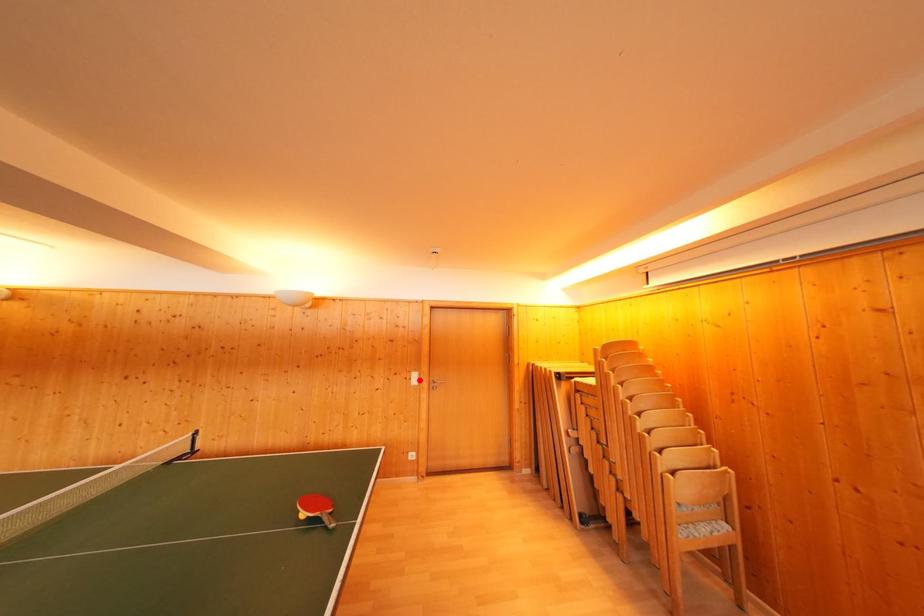
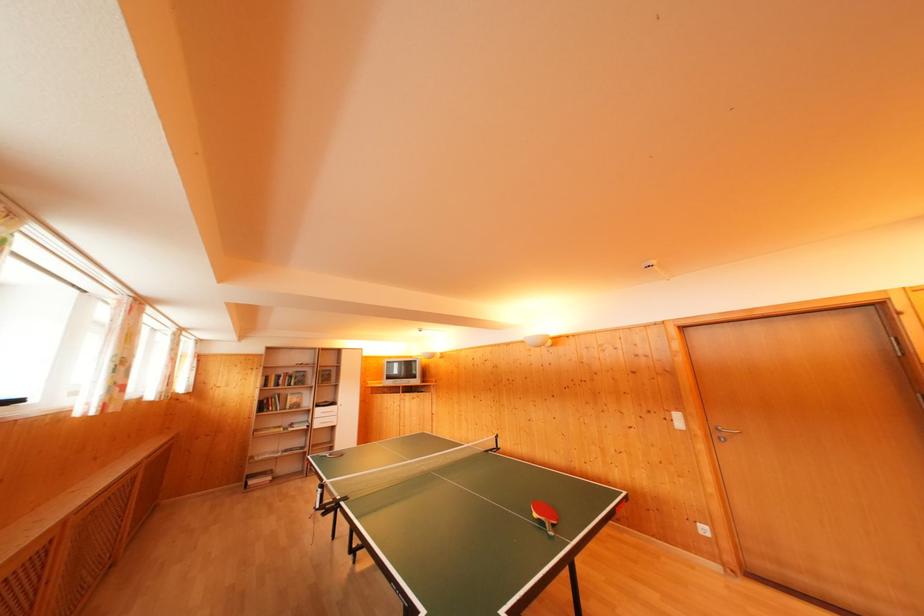
The point at the highlighted location is marked in the first image. Where is the corresponding point in the second image?

(682, 421)